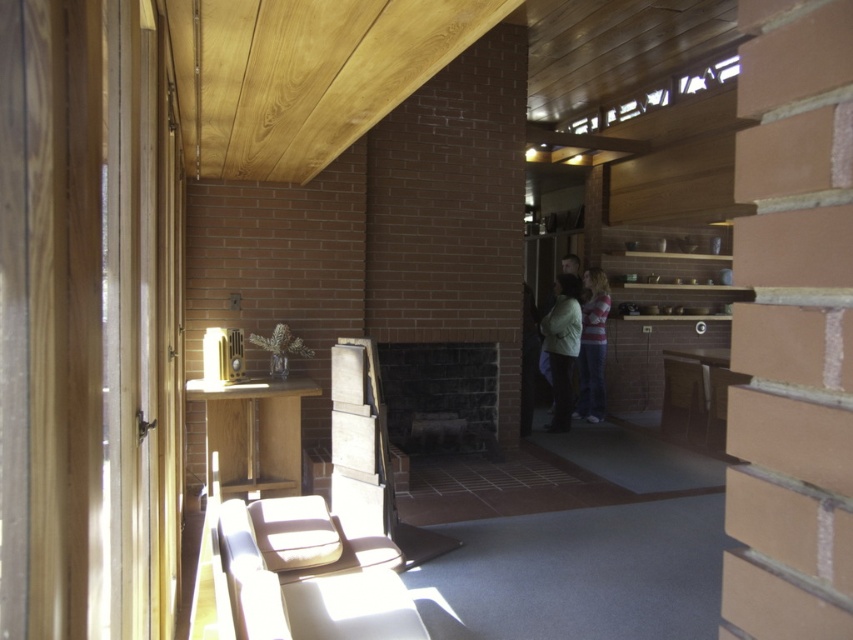
Which of these two, wooden plank ceiling at upper center or striped cotton shirt at center, stands shorter?

wooden plank ceiling at upper center is shorter.

Does point (329, 64) come farther from viewer compared to point (589, 298)?

That is False.

Where is `wooden plank ceiling at upper center`? This screenshot has height=640, width=853. wooden plank ceiling at upper center is located at coordinates (305, 74).

Is light beige sweater at center positioned at the back of striped cotton shirt at center?

No, it is in front of striped cotton shirt at center.

Is point (560, 330) positioned after point (589, 326)?

No.

What do you see at coordinates (561, 346) in the screenshot? The height and width of the screenshot is (640, 853). I see `light beige sweater at center` at bounding box center [561, 346].

The height and width of the screenshot is (640, 853). In order to click on light beige sweater at center in this screenshot , I will do (561, 346).

Which is behind, point (364, 92) or point (561, 282)?

The point (561, 282) is behind.

Measure the distance between wooden plank ceiling at upper center and camera.

wooden plank ceiling at upper center and camera are 5.86 feet apart from each other.

Where is `wooden plank ceiling at upper center`? This screenshot has height=640, width=853. wooden plank ceiling at upper center is located at coordinates click(x=305, y=74).

At what (x,y) coordinates should I click in order to perform the action: click on wooden plank ceiling at upper center. Please return your answer as a coordinate pair (x, y). Looking at the image, I should click on (305, 74).